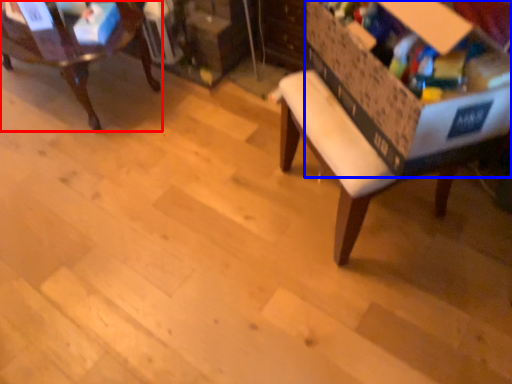
Question: Among these objects, which one is farthest to the camera, chair (highlighted by a red box) or storage box (highlighted by a blue box)?

Choices:
 (A) chair
 (B) storage box

Answer: (A)